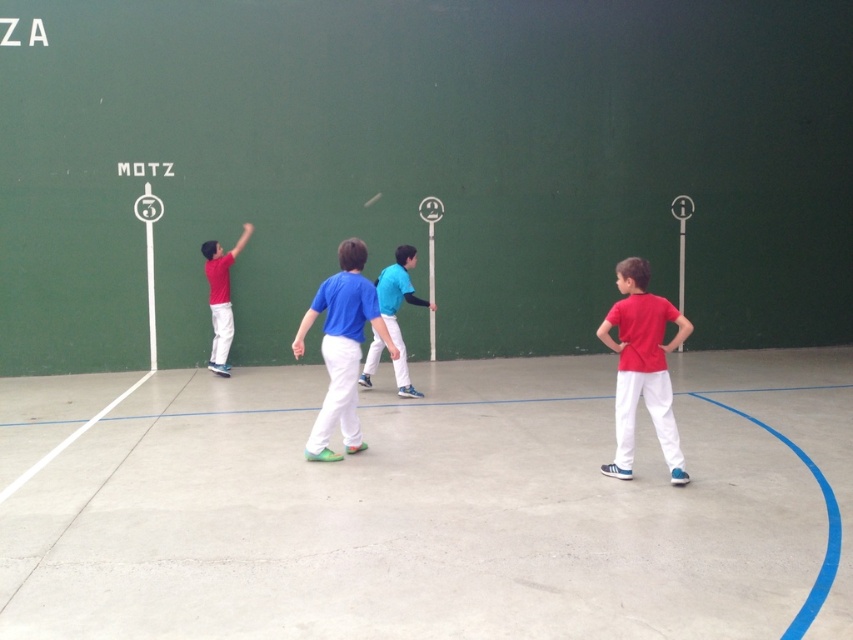
You are standing at the center of the court and want to throw a ball to the player wearing a red shirt at right. Which direction should you aim? The court has a green wall with scoring zones marked with numbers 3, 2, and 1. The player is located at point (x=642, y=368). The court coordinates are normalized between 0 and 1, where 0 is the bottom left corner and 1 is the top right corner. The wall is on the right side of the court. The red shirt at right is positioned at the right side of the court. The player,

To reach the red shirt at right located at point (x=642, y=368), you should aim towards the upper right section of the green wall since the coordinates indicate a position closer to the top right corner of the court.

You are a new player in the pelota game and want to position yourself in the best spot to hit the ball. You see two points marked on the court at coordinates point (660,397) and point (352,268). Which point is closer to you as you stand at the baseline?

Point (660,397) is in front of point (352,268), so it is closer to you as you stand at the baseline.

You are a referee in the game and need to determine which player is out of position. The rule states that the player in the blue cotton shirt at center must be to the right of the blue jersey at center. Are they positioned correctly?

The blue cotton shirt at center is positioned on the left side of the blue jersey at center, which means they are not positioned correctly according to the rule that requires the blue cotton shirt at center to be to the right of the blue jersey at center.